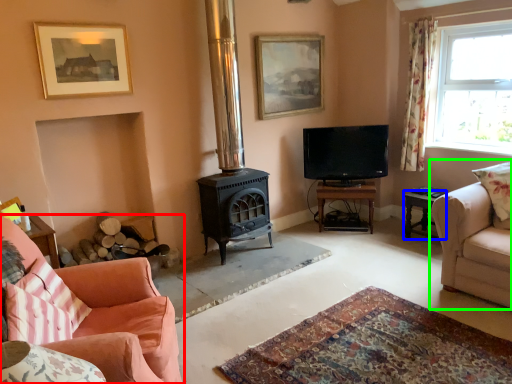
Question: Which object is the closest to the studio couch (highlighted by a red box)? Choose among these: table (highlighted by a blue box) or studio couch (highlighted by a green box).

Choices:
 (A) table
 (B) studio couch

Answer: (B)